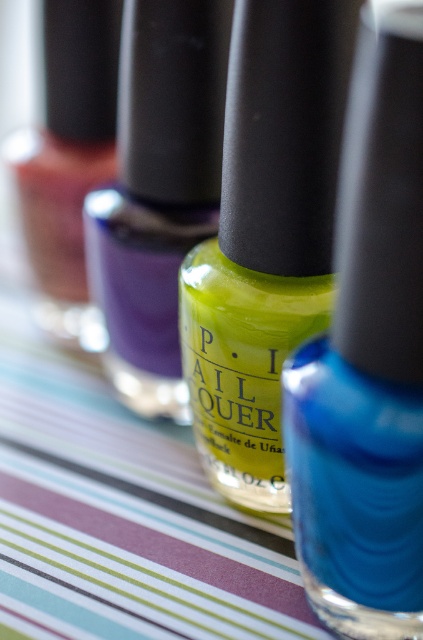
Question: Is matte yellow nail polish at center to the left of glossy glass nail polish at center from the viewer's perspective?

Choices:
 (A) no
 (B) yes

Answer: (A)

Question: Does matte yellow nail polish at center appear under lime green glossy nail polish at center?

Choices:
 (A) no
 (B) yes

Answer: (B)

Question: Which object is farther from the camera taking this photo?

Choices:
 (A) lime green glossy nail polish at center
 (B) glossy glass nail polish at center
 (C) matte yellow nail polish at center

Answer: (B)

Question: Among these points, which one is farthest from the camera?

Choices:
 (A) pyautogui.click(x=280, y=323)
 (B) pyautogui.click(x=338, y=234)

Answer: (B)

Question: Estimate the real-world distances between objects in this image. Which object is closer to the lime green glossy nail polish at center?

Choices:
 (A) matte yellow nail polish at center
 (B) glossy glass nail polish at center

Answer: (A)

Question: Can you confirm if matte yellow nail polish at center is wider than lime green glossy nail polish at center?

Choices:
 (A) no
 (B) yes

Answer: (A)